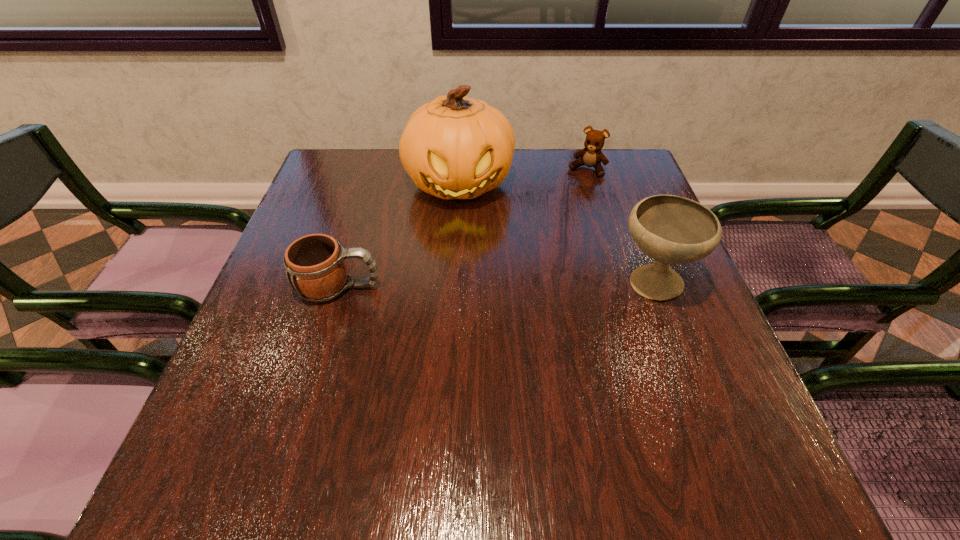
Locate an element on the screen. empty location between the third shortest object and the teddy bear is located at coordinates (619, 226).

Identify the location of vacant point located between the teddy bear and the pumpkin. (523, 177).

You are a GUI agent. You are given a task and a screenshot of the screen. Output one action in this format:
    pyautogui.click(x=<x>, y=<y>)
    Task: Click on the vacant space that is in between the teddy bear and the third shortest object
    The height and width of the screenshot is (540, 960).
    Given the screenshot: What is the action you would take?
    pyautogui.click(x=619, y=226)

The height and width of the screenshot is (540, 960). I want to click on free spot between the second tallest object and the mug, so click(x=495, y=285).

Locate an element on the screen. The height and width of the screenshot is (540, 960). vacant space that's between the teddy bear and the tallest object is located at coordinates (523, 177).

Find the location of a particular element. The image size is (960, 540). object that ranks as the closest to the third shortest object is located at coordinates (454, 147).

Select which object is the second closest to the third shortest object. Please provide its 2D coordinates. Your answer should be formatted as a tuple, i.e. [(x, y)], where the tuple contains the x and y coordinates of a point satisfying the conditions above.

[(591, 156)]

At what (x,y) coordinates should I click in order to perform the action: click on free spot that satisfies the following two spatial constraints: 1. on the back side of the tallest object; 2. on the left side of the teddy bear. Please return your answer as a coordinate pair (x, y). Looking at the image, I should click on (460, 170).